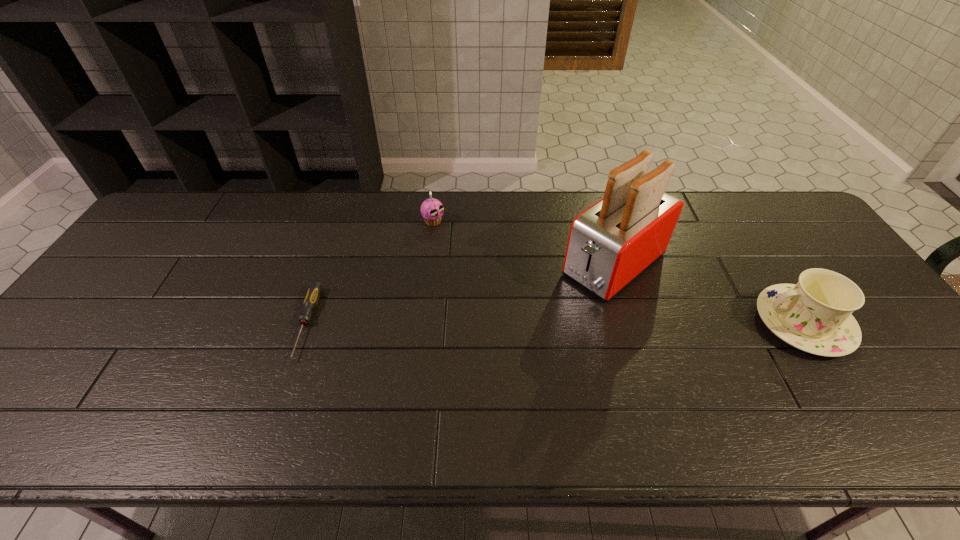
Where is `vacant point at the far edge`? vacant point at the far edge is located at coordinates coord(348,198).

Where is `free spot at the near edge of the desktop`? The width and height of the screenshot is (960, 540). free spot at the near edge of the desktop is located at coordinates tap(656, 376).

At what (x,y) coordinates should I click in order to perform the action: click on vacant space at the left edge of the desktop. Please return your answer as a coordinate pair (x, y). Looking at the image, I should click on (109, 296).

In the image, there is a desktop. Where is `vacant region at the far right corner`? This screenshot has height=540, width=960. vacant region at the far right corner is located at coordinates coord(756,210).

Locate an element on the screen. This screenshot has width=960, height=540. vacant space at the near right corner of the desktop is located at coordinates (906, 382).

This screenshot has height=540, width=960. I want to click on free space between the chinaware and the toaster, so click(x=708, y=294).

Where is `blank region between the toaster and the cupcake`? This screenshot has width=960, height=540. blank region between the toaster and the cupcake is located at coordinates (524, 243).

The height and width of the screenshot is (540, 960). Find the location of `vacant area between the shortest object and the third object from left to right`. vacant area between the shortest object and the third object from left to right is located at coordinates (461, 294).

Locate an element on the screen. vacant area that lies between the rightmost object and the shortest object is located at coordinates tap(555, 323).

Find the location of a particular element. Image resolution: width=960 pixels, height=540 pixels. vacant space that's between the leftmost object and the toaster is located at coordinates (461, 294).